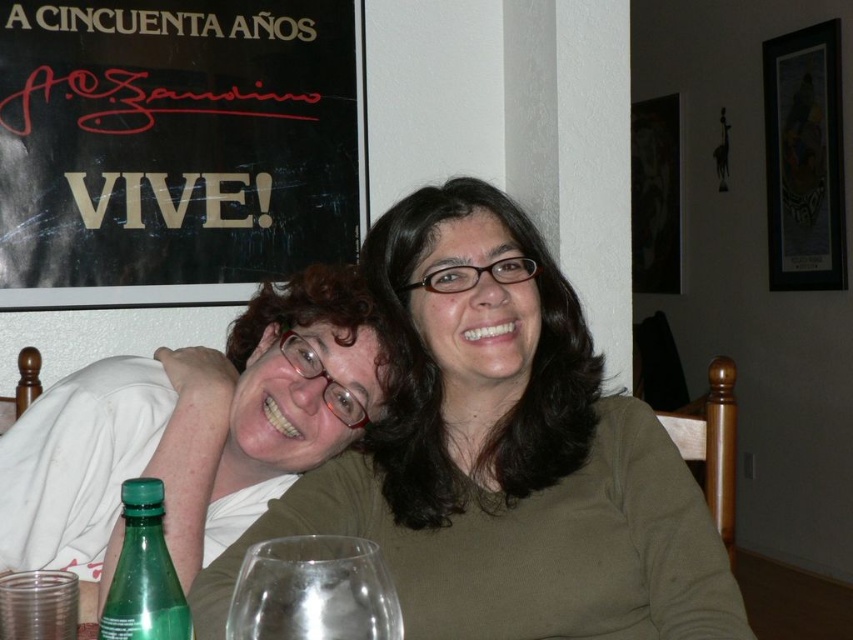
Does point (647, 593) come in front of point (329, 58)?

Yes, point (647, 593) is in front of point (329, 58).

Consider the image. Who is taller, matte green shirt at center or black paper at upper left?

black paper at upper left is taller.

Between point (485, 476) and point (70, 241), which one is positioned in front?

Point (485, 476) is in front.

Locate an element on the screen. This screenshot has height=640, width=853. matte green shirt at center is located at coordinates pyautogui.click(x=505, y=456).

Can you confirm if matte green shirt at center is thinner than transparent glass at lower center?

Incorrect, matte green shirt at center's width is not less than transparent glass at lower center's.

Between matte green shirt at center and transparent glass at lower center, which one has less height?

With less height is transparent glass at lower center.

Which is behind, point (634, 472) or point (285, 566)?

The point (634, 472) is behind.

Where is `matte green shirt at center`? This screenshot has width=853, height=640. matte green shirt at center is located at coordinates (505, 456).

This screenshot has height=640, width=853. What do you see at coordinates (195, 432) in the screenshot? I see `matte white shirt at left` at bounding box center [195, 432].

Does matte white shirt at left appear over transparent glass at lower center?

Indeed, matte white shirt at left is positioned over transparent glass at lower center.

Identify the location of matte white shirt at left. (195, 432).